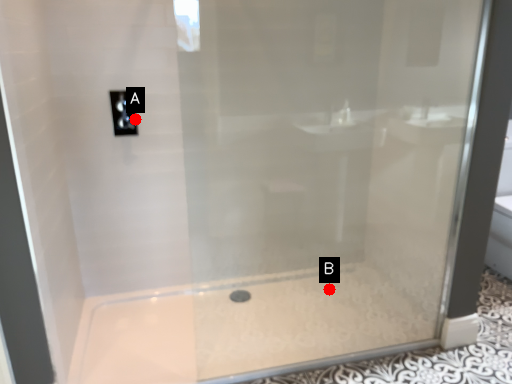
Question: Two points are circled on the image, labeled by A and B beside each circle. Which point is closer to the camera?

Choices:
 (A) A is closer
 (B) B is closer

Answer: (A)